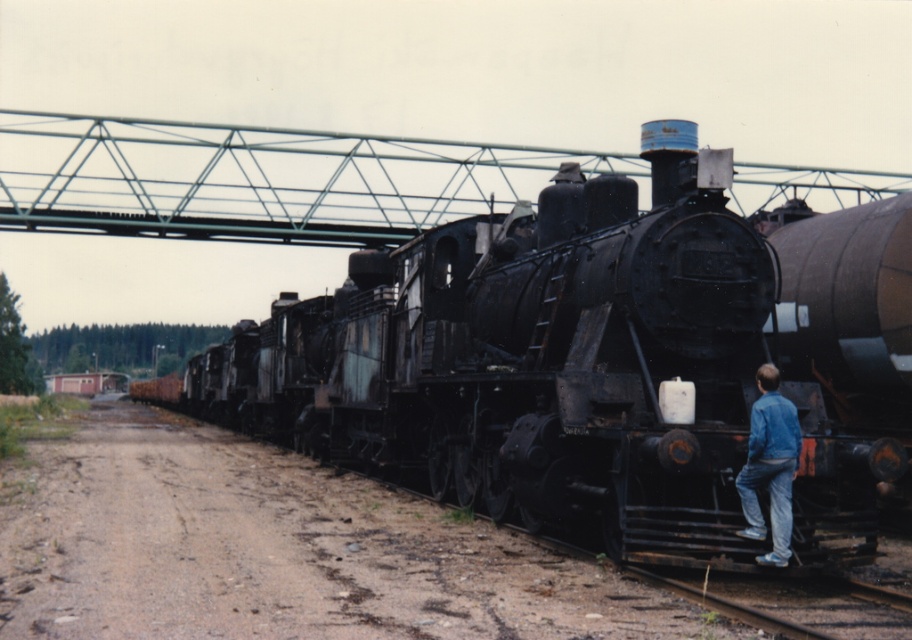
You are a maintenance worker at the railway yard. You need to inspect the rusty metal train at center from your current position near the blue denim jacket at lower right. Is the distance between you and the train sufficient to safely operate a 12 meter long inspection vehicle?

The rusty metal train at center is 10.34 meters away from the blue denim jacket at lower right. Since the inspection vehicle requires 12 meters to operate safely, the distance is insufficient. You need to move further back or find a longer path.

You are standing in a railway yard and see the rusty metal train at center and the blue denim jacket at lower right. Which object is closer to you?

The blue denim jacket at lower right is closer to you because the rusty metal train at center is further away.